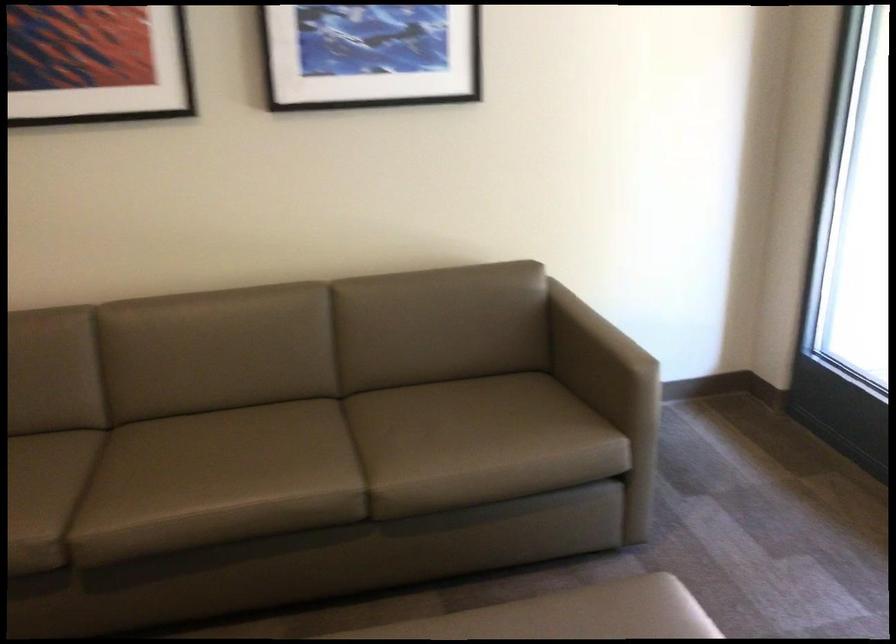
Where would you sit the ottoman sitting surface? Please return your answer as a coordinate pair (x, y).

(597, 618)